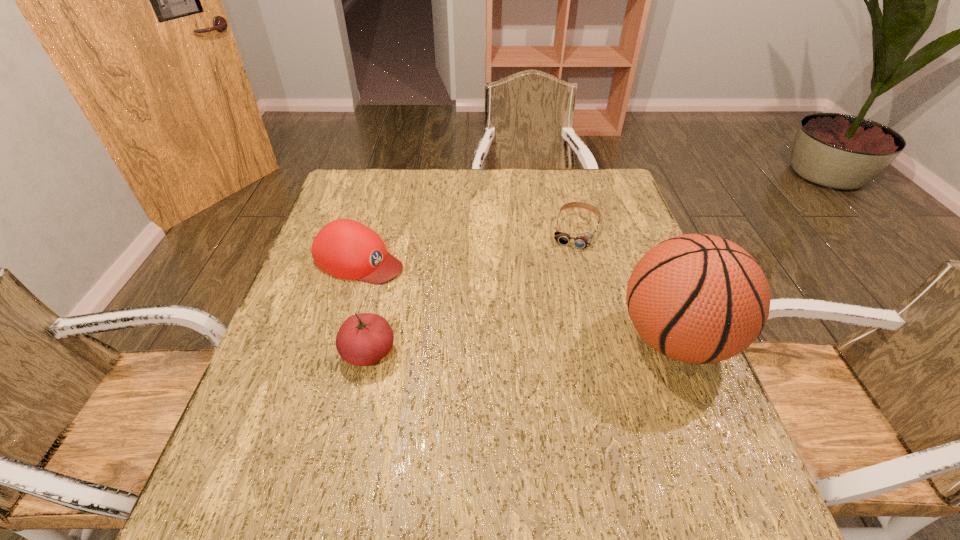
At what (x,y) coordinates should I click in order to perform the action: click on vacant space situated 0.370m on the front-facing side of the shortest object. Please return your answer as a coordinate pair (x, y). Image resolution: width=960 pixels, height=540 pixels. Looking at the image, I should click on (540, 353).

This screenshot has width=960, height=540. In order to click on tomato present at the left edge in this screenshot , I will do `click(363, 339)`.

The height and width of the screenshot is (540, 960). Find the location of `baseball cap positioned at the left edge`. baseball cap positioned at the left edge is located at coordinates (344, 248).

Locate an element on the screen. This screenshot has width=960, height=540. basketball located at the right edge is located at coordinates (697, 298).

Identify the location of goggles that is at the right edge. (584, 240).

Locate an element on the screen. Image resolution: width=960 pixels, height=540 pixels. vacant space at the far edge of the desktop is located at coordinates (510, 199).

In the image, there is a desktop. Identify the location of vacant space at the near edge. This screenshot has height=540, width=960. (343, 455).

This screenshot has height=540, width=960. I want to click on vacant area at the left edge, so click(288, 313).

This screenshot has width=960, height=540. In the image, there is a desktop. In order to click on free space at the right edge in this screenshot , I will do `click(608, 297)`.

This screenshot has width=960, height=540. Identify the location of vacant space at the near left corner. (244, 434).